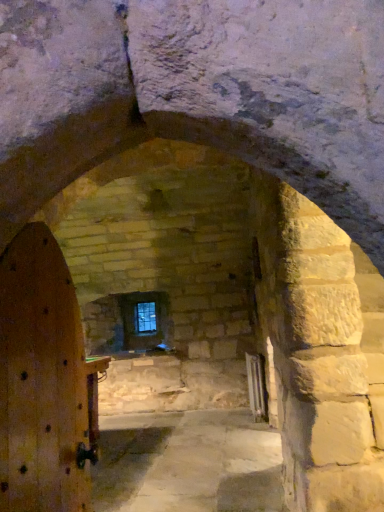
Measure the distance between clear glass window at center and camera.

6.24 meters.

Describe the element at coordinates (145, 317) in the screenshot. I see `clear glass window at center` at that location.

Image resolution: width=384 pixels, height=512 pixels. I want to click on clear glass window at center, so click(145, 317).

Locate an element on the screen. wooden door at left is located at coordinates (42, 380).

The image size is (384, 512). Describe the element at coordinates (42, 380) in the screenshot. I see `wooden door at left` at that location.

Where is `clear glass window at center`? This screenshot has height=512, width=384. clear glass window at center is located at coordinates 145,317.

Between wooden door at left and clear glass window at center, which one appears on the left side from the viewer's perspective?

From the viewer's perspective, clear glass window at center appears more on the left side.

Which object is further away from the camera, wooden door at left or clear glass window at center?

clear glass window at center.

Between point (2, 459) and point (146, 310), which one is positioned behind?

The point (146, 310) is farther from the camera.

Based on the photo, from the image's perspective, who appears lower, wooden door at left or clear glass window at center?

clear glass window at center is shown below in the image.

From a real-world perspective, is wooden door at left positioned above or below clear glass window at center?

In terms of real-world spatial position, wooden door at left is below clear glass window at center.

Can you confirm if wooden door at left is thinner than clear glass window at center?

Incorrect, the width of wooden door at left is not less than that of clear glass window at center.

Between wooden door at left and clear glass window at center, which one has more height?

With more height is wooden door at left.

Which of these two, wooden door at left or clear glass window at center, is smaller?

clear glass window at center.

Which is correct: wooden door at left is inside clear glass window at center, or outside of it?

wooden door at left is not inside clear glass window at center, it's outside.

Is wooden door at left positioned far away from clear glass window at center?

Absolutely, wooden door at left is distant from clear glass window at center.

In the scene shown: Is wooden door at left facing away from clear glass window at center?

No.

Measure the distance between wooden door at left and clear glass window at center.

wooden door at left is 4.58 meters from clear glass window at center.

Where is `window lying below the wooden door at left (from the image's perspective)`? The width and height of the screenshot is (384, 512). window lying below the wooden door at left (from the image's perspective) is located at coordinates (145, 317).

Is clear glass window at center to the left or to the right of wooden door at left in the image?

From the image, it's evident that clear glass window at center is to the left of wooden door at left.

Is clear glass window at center behind wooden door at left?

Yes, it is.

Considering the positions of points (151, 315) and (63, 473), is point (151, 315) closer to camera compared to point (63, 473)?

That is False.

From the image's perspective, is clear glass window at center located above or below wooden door at left?

clear glass window at center is below wooden door at left.

From a real-world perspective, is clear glass window at center above or below wooden door at left?

In terms of real-world spatial position, clear glass window at center is above wooden door at left.

Does clear glass window at center have a greater width compared to wooden door at left?

Incorrect, the width of clear glass window at center does not surpass that of wooden door at left.

Can you confirm if clear glass window at center is shorter than wooden door at left?

Indeed, clear glass window at center has a lesser height compared to wooden door at left.

In the scene shown: Does clear glass window at center have a larger size compared to wooden door at left?

Incorrect, clear glass window at center is not larger than wooden door at left.

Would you say wooden door at left is part of clear glass window at center's contents?

No, wooden door at left is located outside of clear glass window at center.

Is clear glass window at center far from wooden door at left?

Yes, clear glass window at center and wooden door at left are located far from each other.

Could you tell me if clear glass window at center is facing wooden door at left?

Yes, clear glass window at center is aimed at wooden door at left.

Can you tell me how much clear glass window at center and wooden door at left differ in facing direction?

98 degrees separate the facing orientations of clear glass window at center and wooden door at left.

Locate an element on the screen. The width and height of the screenshot is (384, 512). window below the wooden door at left (from the image's perspective) is located at coordinates (145, 317).

The image size is (384, 512). I want to click on door located underneath the clear glass window at center (from a real-world perspective), so click(x=42, y=380).

Locate an element on the screen. Image resolution: width=384 pixels, height=512 pixels. window below the wooden door at left (from the image's perspective) is located at coordinates (145, 317).